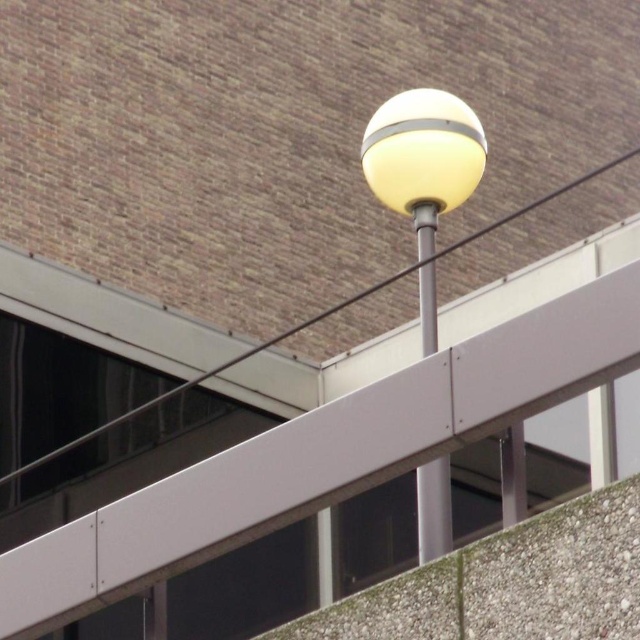
Question: Does matte white globe at center lie behind metallic pole at center?

Choices:
 (A) no
 (B) yes

Answer: (B)

Question: Among these points, which one is nearest to the camera?

Choices:
 (A) (429, 481)
 (B) (445, 104)

Answer: (A)

Question: Does matte white globe at center lie in front of metallic pole at center?

Choices:
 (A) no
 (B) yes

Answer: (A)

Question: Can you confirm if matte white globe at center is bigger than metallic pole at center?

Choices:
 (A) yes
 (B) no

Answer: (A)

Question: Among these points, which one is farthest from the camera?

Choices:
 (A) (476, 179)
 (B) (435, 212)

Answer: (A)